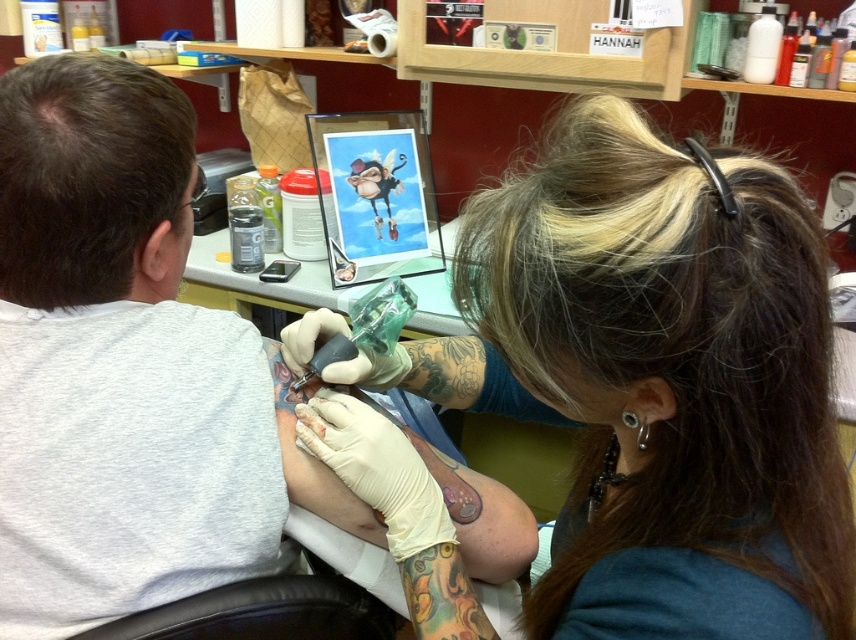
Does smooth skin at upper right come behind white latex gloves at upper center?

No.

Who is more forward, (827, 625) or (268, 342)?

Point (827, 625)

Find the location of a particular element. smooth skin at upper right is located at coordinates (658, 380).